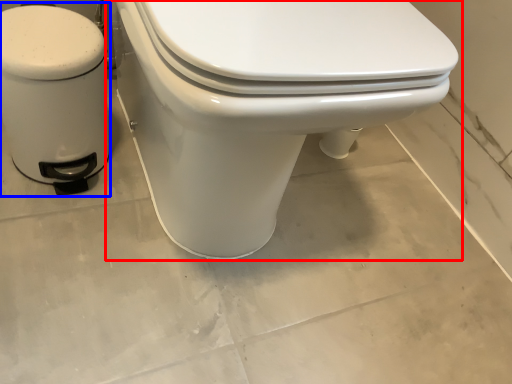
Question: Which object appears farthest to the camera in this image, toilet (highlighted by a red box) or water heater (highlighted by a blue box)?

Choices:
 (A) toilet
 (B) water heater

Answer: (B)